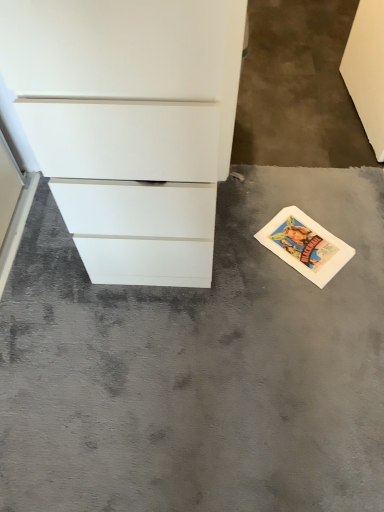
Identify the location of free spot above white paper postcard at lower right (from a real-world perspective). The height and width of the screenshot is (512, 384). (312, 245).